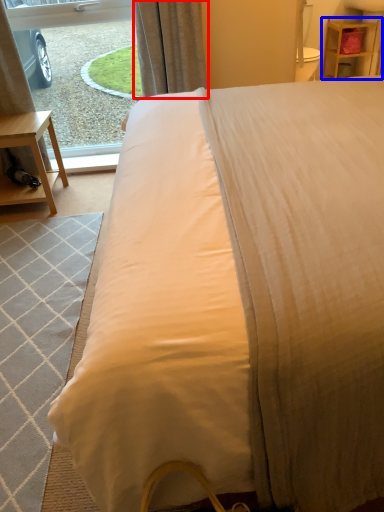
Question: Which object is further to the camera taking this photo, curtain (highlighted by a red box) or nightstand (highlighted by a blue box)?

Choices:
 (A) curtain
 (B) nightstand

Answer: (B)